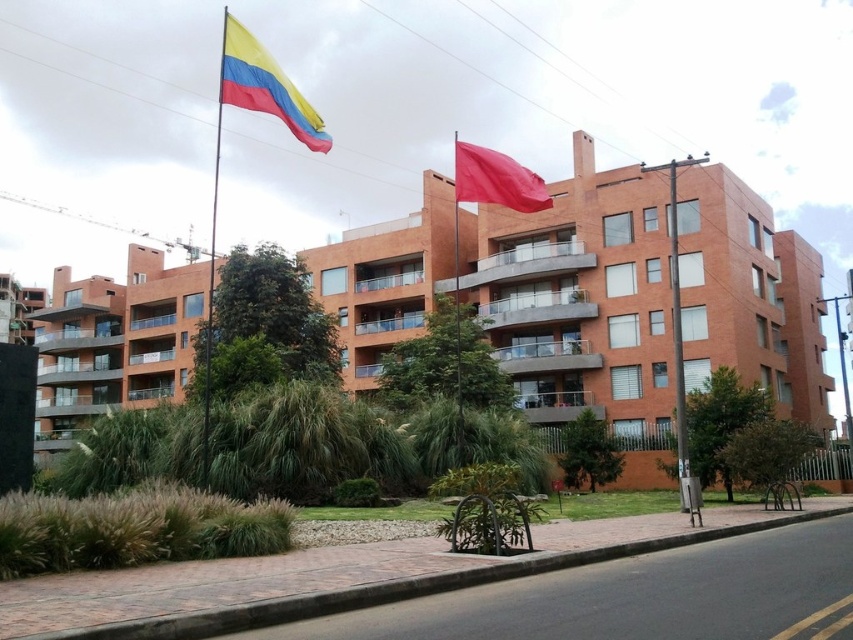
You are a city planner assessing the placement of a new surveillance camera. The camera needs to be installed at least 15 meters away from the metallic gray pole at center to avoid obstruction. Based on the current setup, is the camera positioned appropriately?

The metallic gray pole at center and camera are 13.79 meters apart from each other. Since the required distance is at least 15 meters, the camera is too close and not positioned appropriately.